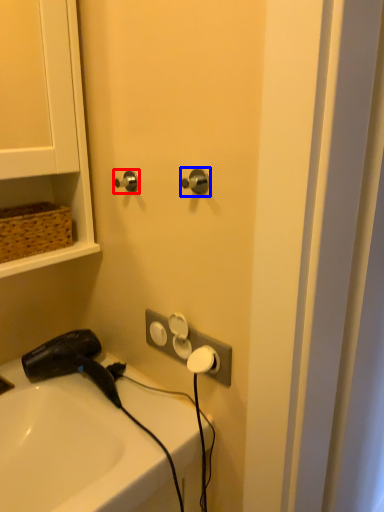
Question: Which object is closer to the camera taking this photo, door handle (highlighted by a red box) or door handle (highlighted by a blue box)?

Choices:
 (A) door handle
 (B) door handle

Answer: (B)